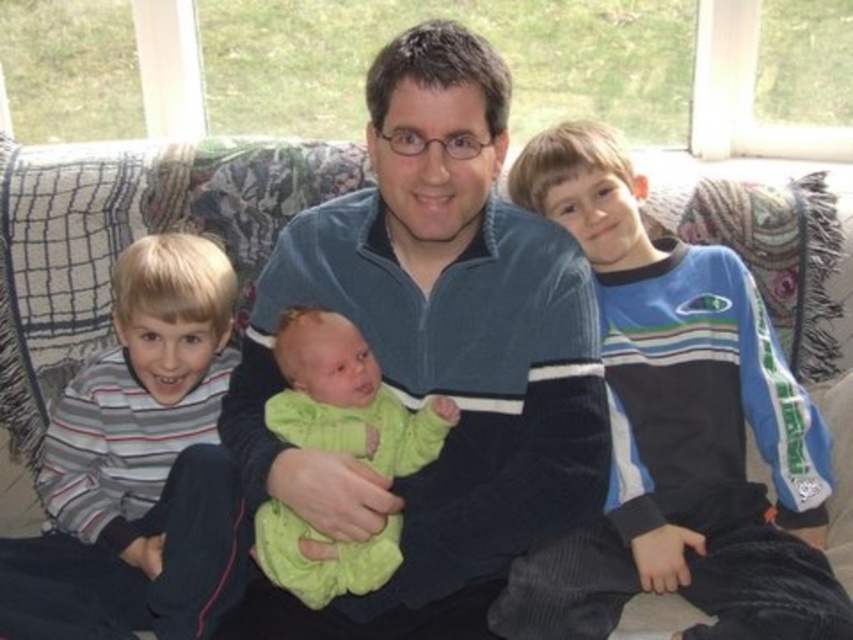
Question: Considering the real-world distances, which object is closest to the soft green knit sweater at center?

Choices:
 (A) velvet blue sweater at center
 (B) blue velour jacket at right

Answer: (A)

Question: Is striped cotton shirt at left positioned in front of soft green knit sweater at center?

Choices:
 (A) yes
 (B) no

Answer: (B)

Question: Which of the following is the farthest from the observer?

Choices:
 (A) (589, 176)
 (B) (440, 438)
 (C) (149, 253)
 (D) (473, 115)

Answer: (A)

Question: Can you confirm if blue velour jacket at right is positioned below striped cotton shirt at left?

Choices:
 (A) no
 (B) yes

Answer: (A)

Question: Is velvet blue sweater at center wider than blue velour jacket at right?

Choices:
 (A) yes
 (B) no

Answer: (A)

Question: Estimate the real-world distances between objects in this image. Which object is closer to the striped cotton shirt at left?

Choices:
 (A) velvet blue sweater at center
 (B) soft green knit sweater at center
 (C) blue velour jacket at right

Answer: (B)